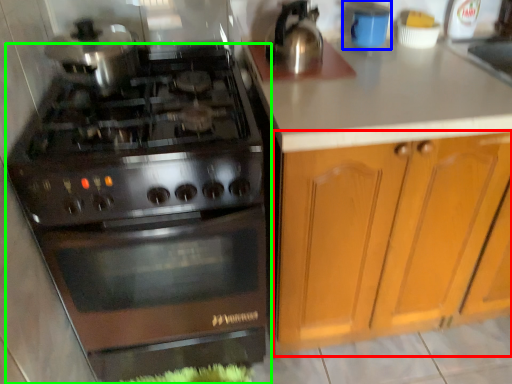
Question: Which object is positioned closest to cabinetry (highlighted by a red box)? Select from appliance (highlighted by a blue box) and gas stove (highlighted by a green box).

Choices:
 (A) appliance
 (B) gas stove

Answer: (B)